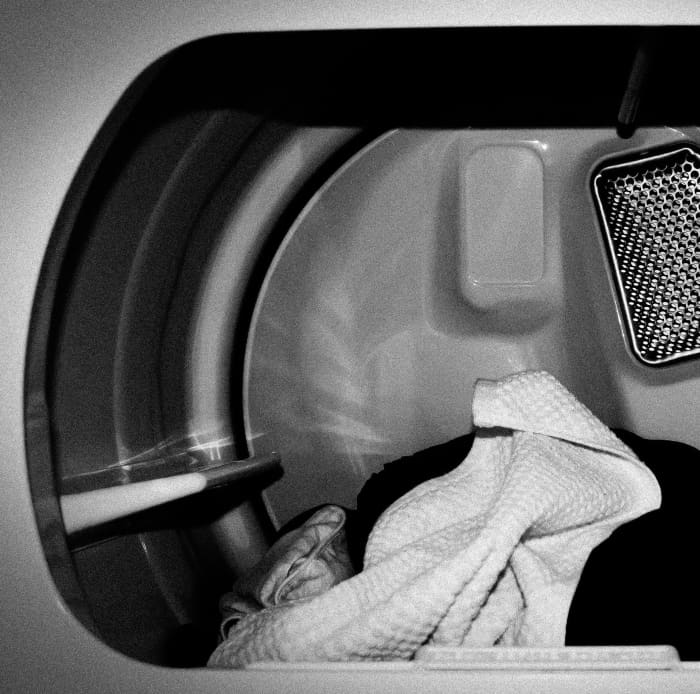
Locate instances of where i would pull the lint filter out from in the image. Your answer should be formatted as a list of tuples, i.e. [(x1, y1), (x2, y2), ...], where each tuple contains the x and y coordinates of a point satisfying the conditions above.

[(568, 665), (423, 666)]